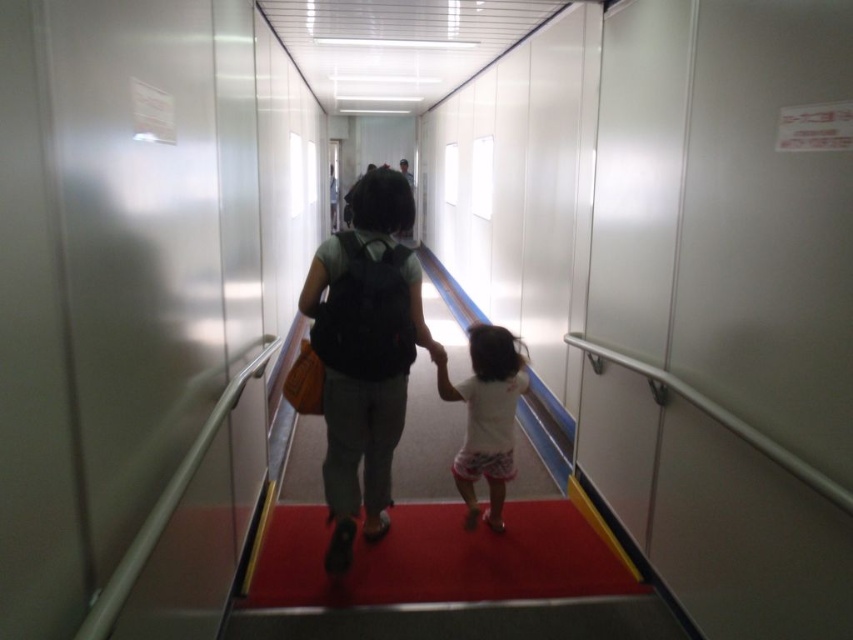
Question: Which of the following is the closest to the observer?

Choices:
 (A) white cotton shirt at center
 (B) matte black backpack at center

Answer: (B)

Question: Which object appears farthest from the camera in this image?

Choices:
 (A) matte black backpack at center
 (B) white cotton shirt at center

Answer: (B)

Question: Among these objects, which one is nearest to the camera?

Choices:
 (A) white cotton shirt at center
 (B) matte black backpack at center

Answer: (B)

Question: Can you confirm if matte black backpack at center is positioned to the right of white cotton shirt at center?

Choices:
 (A) no
 (B) yes

Answer: (A)

Question: Can you confirm if matte black backpack at center is smaller than white cotton shirt at center?

Choices:
 (A) no
 (B) yes

Answer: (A)

Question: Can you confirm if matte black backpack at center is positioned to the left of white cotton shirt at center?

Choices:
 (A) no
 (B) yes

Answer: (B)